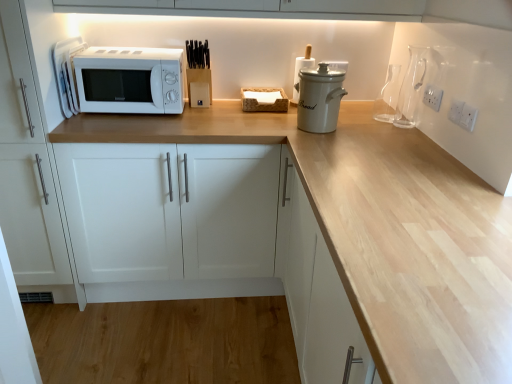
The width and height of the screenshot is (512, 384). I want to click on unoccupied area in front of white matte microwave at left, so click(x=117, y=118).